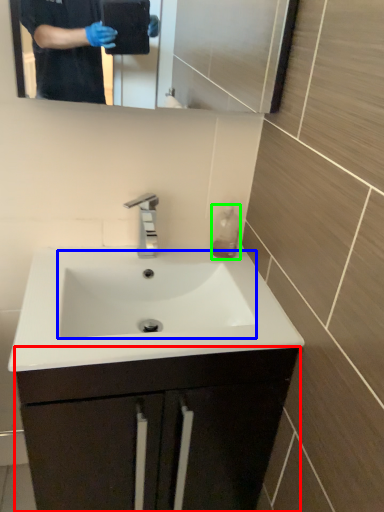
Question: Based on their relative distances, which object is nearer to bathroom cabinet (highlighted by a red box)? Choose from sink (highlighted by a blue box) and liquid (highlighted by a green box).

Choices:
 (A) sink
 (B) liquid

Answer: (A)